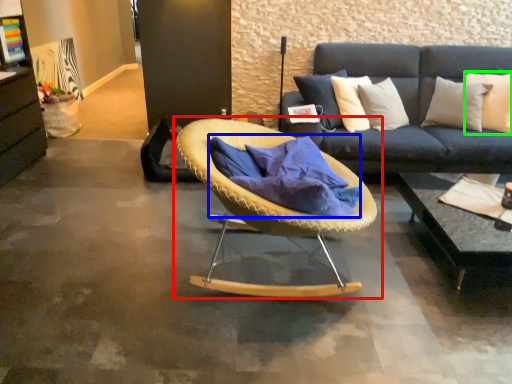
Question: Which is farther away from chair (highlighted by a red box)? blanket (highlighted by a blue box) or pillow (highlighted by a green box)?

Choices:
 (A) blanket
 (B) pillow

Answer: (B)